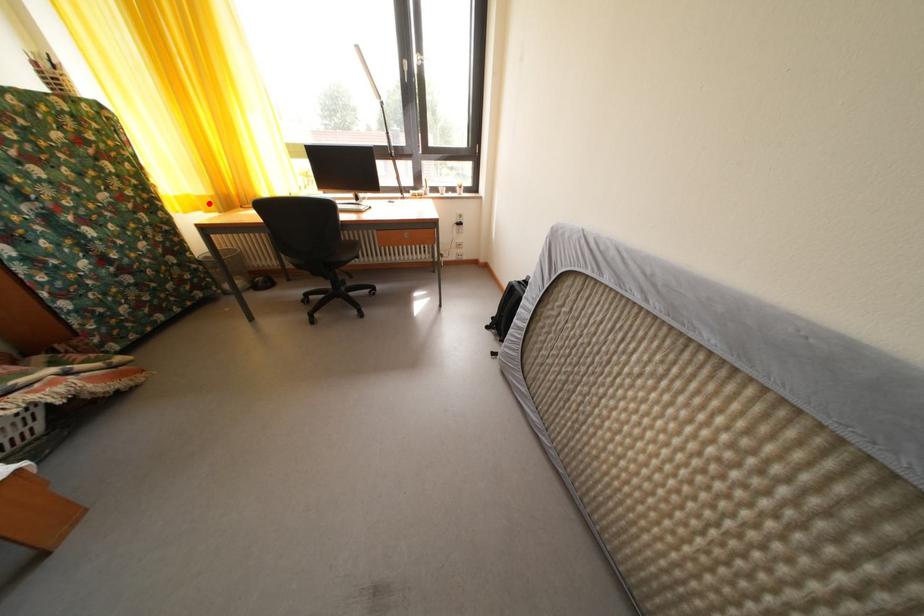
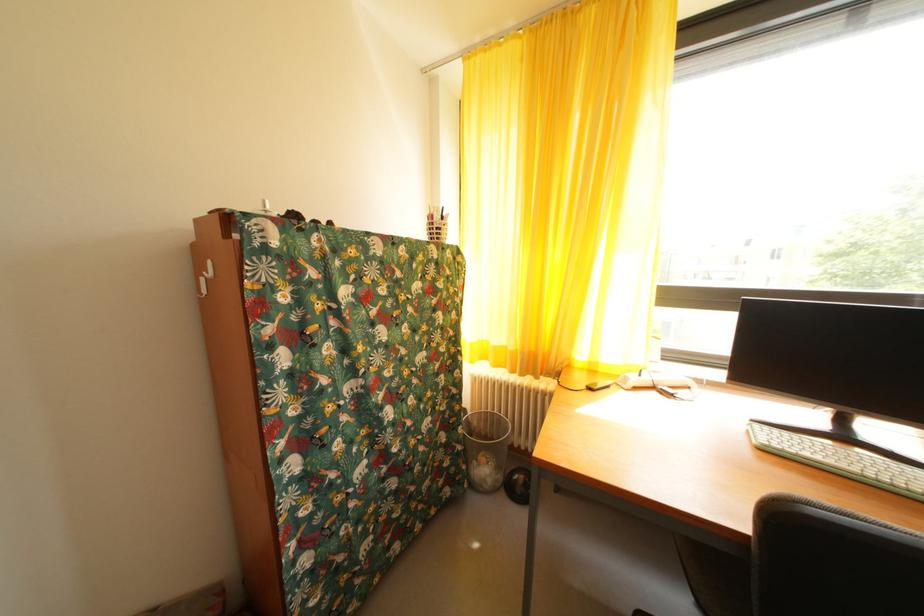
Question: I am providing you with two images of the same scene from different viewpoints. Given a red point in image1, look at the same physical point in image2. Is it:

Choices:
 (A) Closer to the viewpoint
 (B) Farther from the viewpoint

Answer: (B)